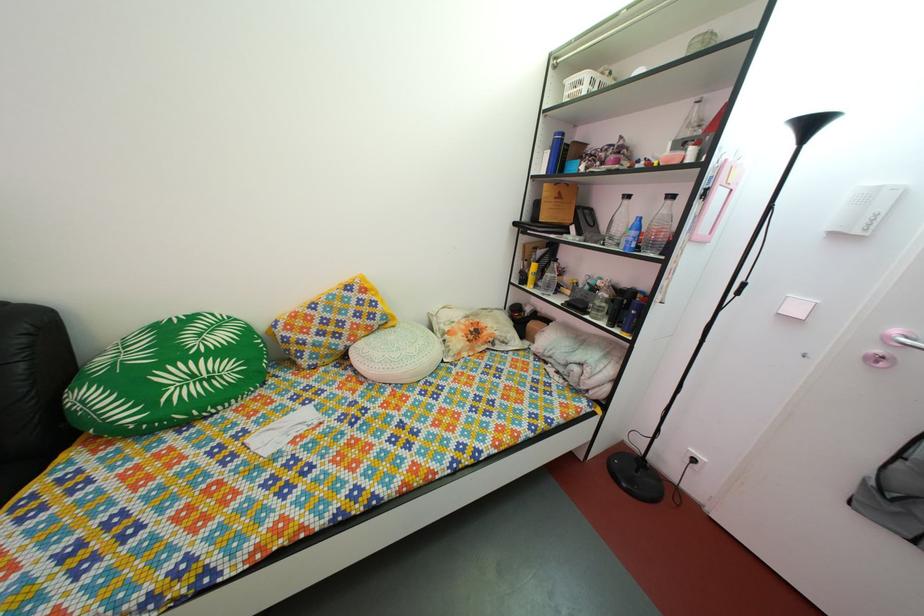
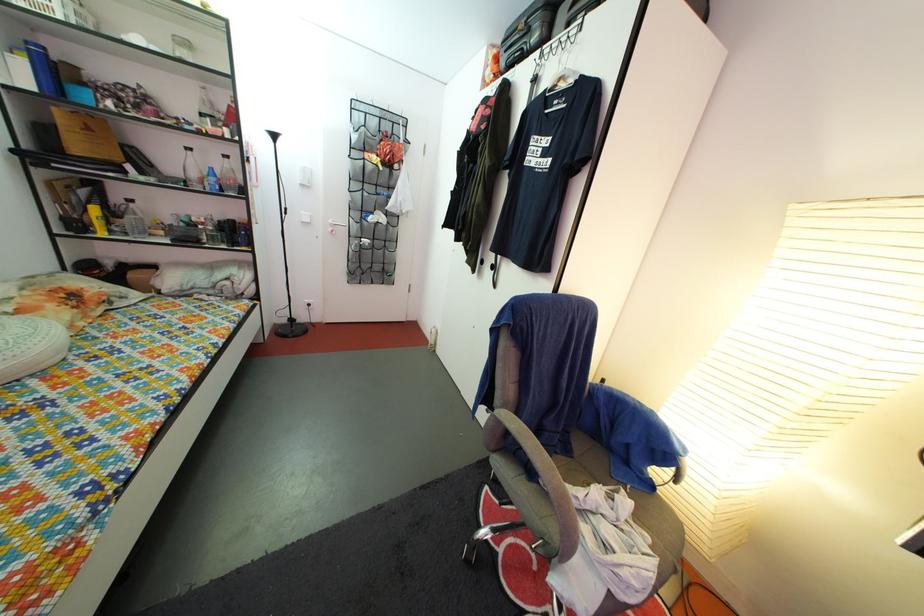
In the second image, find the point that corresponds to (x=649, y=237) in the first image.

(225, 185)